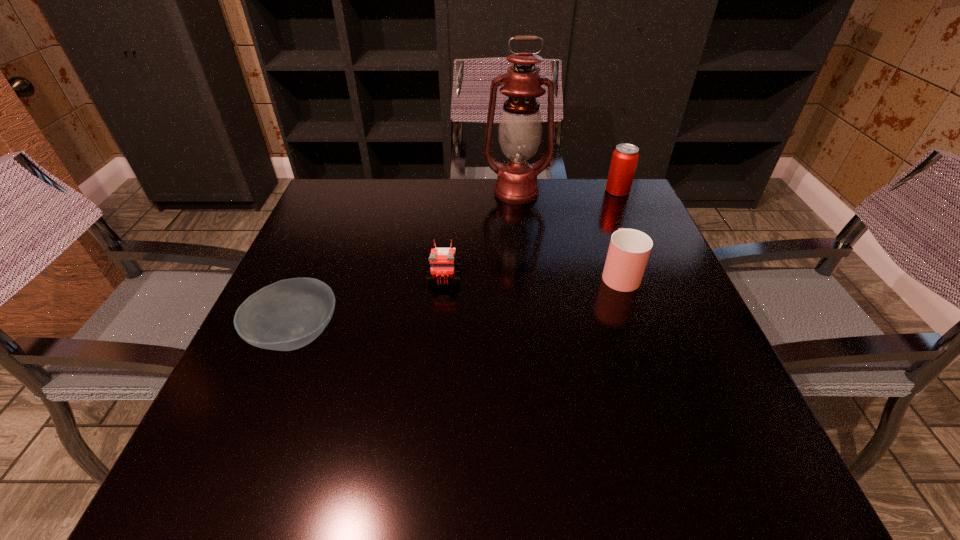
Identify the location of vacant space positioned 0.380m on the left of the rightmost object. The width and height of the screenshot is (960, 540). (475, 191).

Find the location of a particular element. blank space located 0.130m on the side of the second object from right to left with the handle is located at coordinates (602, 225).

At what (x,y) coordinates should I click in order to perform the action: click on free location located on the side of the second object from right to left with the handle. Please return your answer as a coordinate pair (x, y). The height and width of the screenshot is (540, 960). Looking at the image, I should click on (597, 212).

Find the location of a particular element. vacant space situated 0.170m on the side of the second object from right to left with the handle is located at coordinates (599, 216).

You are a GUI agent. You are given a task and a screenshot of the screen. Output one action in this format:
    pyautogui.click(x=<x>, y=<y>)
    Task: Click on the vacant space situated 0.090m on the front-facing side of the fourth object from right to left
    
    Given the screenshot: What is the action you would take?
    pyautogui.click(x=441, y=320)

The width and height of the screenshot is (960, 540). I want to click on free space located on the front of the bowl, so pyautogui.click(x=254, y=438).

Where is `oil lamp present at the far edge`? This screenshot has width=960, height=540. oil lamp present at the far edge is located at coordinates (520, 128).

Where is `can at the far edge`? The height and width of the screenshot is (540, 960). can at the far edge is located at coordinates (625, 157).

At what (x,y) coordinates should I click in order to perform the action: click on object present at the left edge. Please return your answer as a coordinate pair (x, y). The width and height of the screenshot is (960, 540). Looking at the image, I should click on (289, 314).

Locate an element on the screen. This screenshot has width=960, height=540. can that is at the right edge is located at coordinates (625, 157).